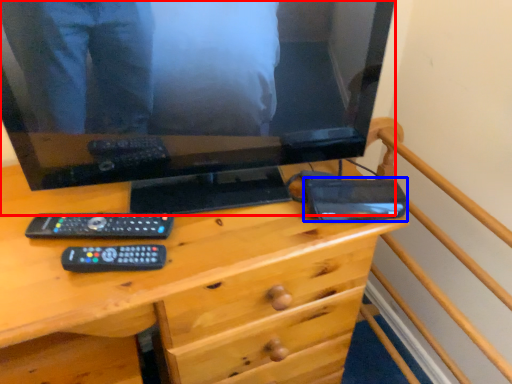
Question: Which of the following is the closest to the observer, television (highlighted by a red box) or gadget (highlighted by a blue box)?

Choices:
 (A) television
 (B) gadget

Answer: (A)